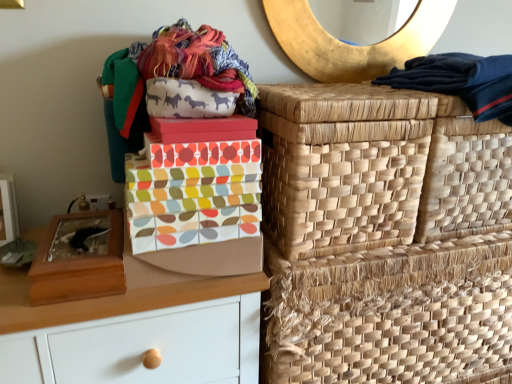
Identify the location of empty space that is ontop of wooden shoe box at left, the 2th shoe box in the right-to-left sequence. This screenshot has height=384, width=512. (82, 234).